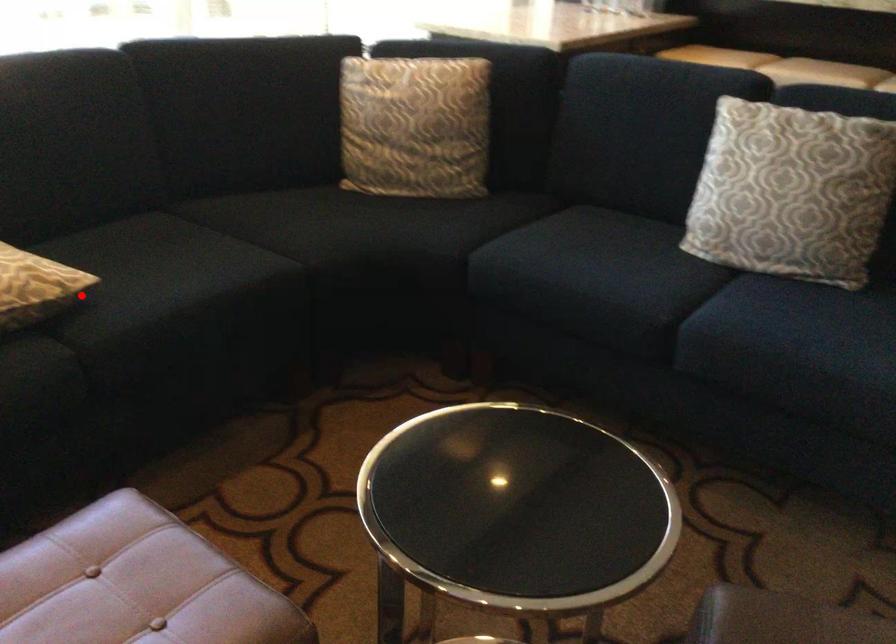
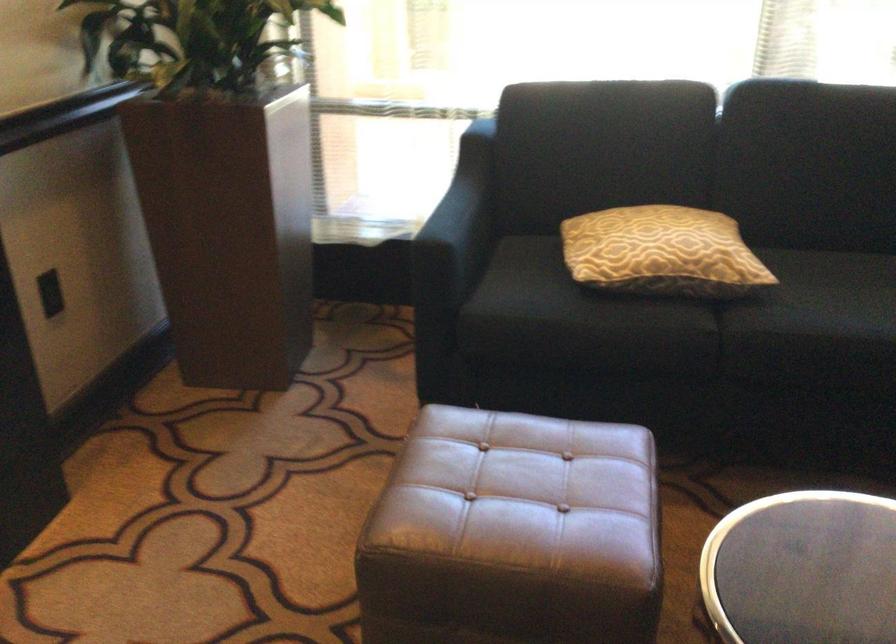
Question: I am providing you with two images of the same scene from different viewpoints. In image1, a red point is highlighted. Considering the same 3D point in image2, which of the following is correct?

Choices:
 (A) It is closer
 (B) It is farther

Answer: (B)